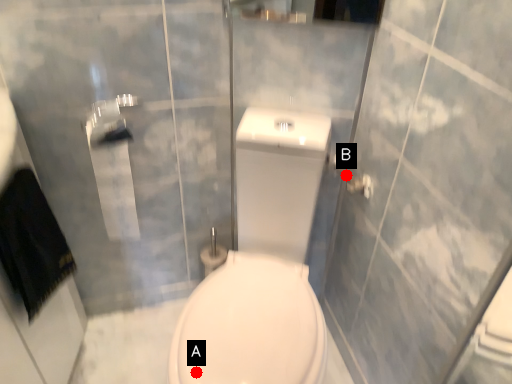
Question: Two points are circled on the image, labeled by A and B beside each circle. Which point is closer to the camera?

Choices:
 (A) A is closer
 (B) B is closer

Answer: (A)